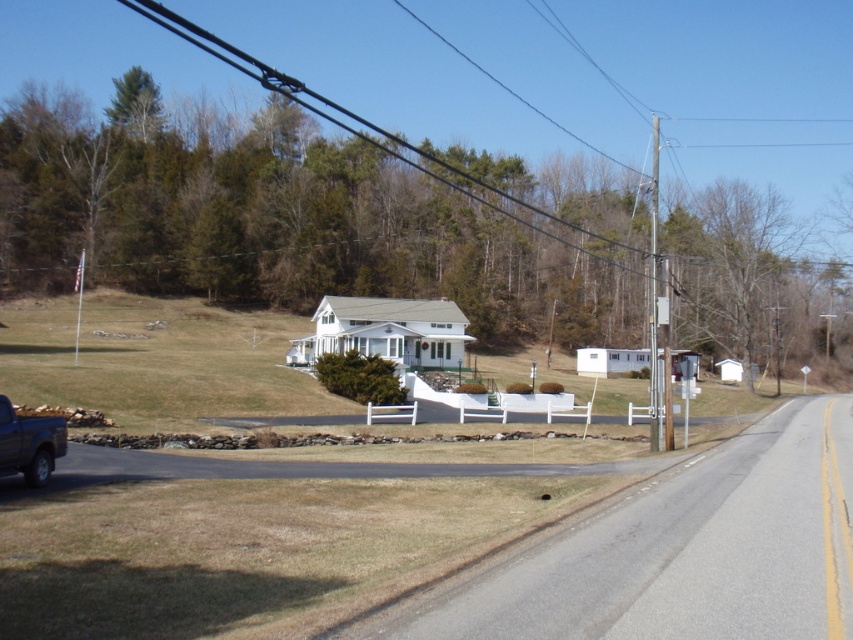
Can you confirm if black wire at upper center is positioned below dark gray metallic truck at lower left?

Actually, black wire at upper center is above dark gray metallic truck at lower left.

Between black wire at upper center and dark gray metallic truck at lower left, which one appears on the left side from the viewer's perspective?

black wire at upper center is more to the left.

In order to click on black wire at upper center in this screenshot , I will do (x=374, y=131).